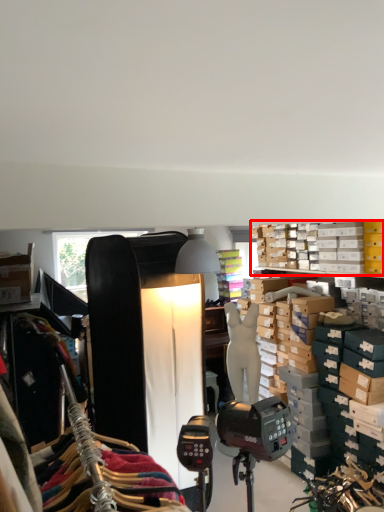
Question: In this image, where is shelf (annotated by the red box) located relative to mannequin?

Choices:
 (A) right
 (B) left

Answer: (A)